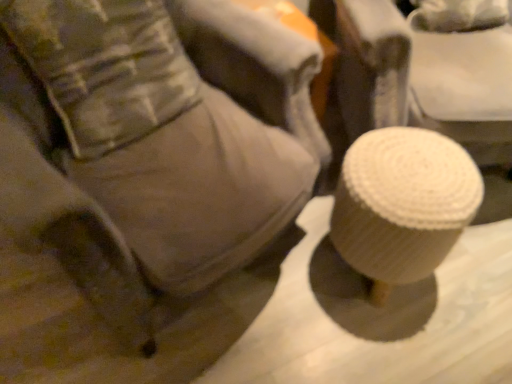
What do you see at coordinates (145, 183) in the screenshot? The image size is (512, 384). I see `white textured stool at lower right` at bounding box center [145, 183].

Image resolution: width=512 pixels, height=384 pixels. I want to click on white textured stool at lower right, so click(x=145, y=183).

What do you see at coordinates (104, 66) in the screenshot? The width and height of the screenshot is (512, 384). I see `camouflage fabric pillow at upper left` at bounding box center [104, 66].

Locate an element on the screen. Image resolution: width=512 pixels, height=384 pixels. camouflage fabric pillow at upper left is located at coordinates [104, 66].

In order to face camouflage fabric pillow at upper left, should I rotate leftwards or rightwards?

It's best to rotate left around 18.440 degrees.

Locate an element on the screen. This screenshot has width=512, height=384. white textured stool at lower right is located at coordinates (145, 183).

In the image, is camouflage fabric pillow at upper left on the left side or the right side of white textured stool at lower right?

In the image, camouflage fabric pillow at upper left appears on the left side of white textured stool at lower right.

Considering the positions of objects camouflage fabric pillow at upper left and white textured stool at lower right in the image provided, who is in front, camouflage fabric pillow at upper left or white textured stool at lower right?

Positioned in front is white textured stool at lower right.

Considering the positions of points (90, 4) and (142, 79), is point (90, 4) closer to camera compared to point (142, 79)?

Yes, point (90, 4) is in front of point (142, 79).

From the image's perspective, is camouflage fabric pillow at upper left located beneath white textured stool at lower right?

Actually, camouflage fabric pillow at upper left appears above white textured stool at lower right in the image.

From a real-world perspective, does camouflage fabric pillow at upper left stand above white textured stool at lower right?

Yes, from a real-world perspective, camouflage fabric pillow at upper left is over white textured stool at lower right

Considering the sizes of camouflage fabric pillow at upper left and white textured stool at lower right in the image, is camouflage fabric pillow at upper left wider or thinner than white textured stool at lower right?

camouflage fabric pillow at upper left is thinner than white textured stool at lower right.

Who is shorter, camouflage fabric pillow at upper left or white textured stool at lower right?

camouflage fabric pillow at upper left.

Between camouflage fabric pillow at upper left and white textured stool at lower right, which one has larger size?

Bigger between the two is white textured stool at lower right.

Is camouflage fabric pillow at upper left inside the boundaries of white textured stool at lower right, or outside?

camouflage fabric pillow at upper left lies within the bounds of white textured stool at lower right.

Is camouflage fabric pillow at upper left far away from white textured stool at lower right?

No, camouflage fabric pillow at upper left is not far from white textured stool at lower right.

Is camouflage fabric pillow at upper left aimed at white textured stool at lower right?

Yes, camouflage fabric pillow at upper left is oriented towards white textured stool at lower right.

In the image, there is a camouflage fabric pillow at upper left. What are the coordinates of `furniture below it (from a real-world perspective)` in the screenshot? It's located at (145, 183).

Which object is positioned more to the left, white textured stool at lower right or camouflage fabric pillow at upper left?

From the viewer's perspective, camouflage fabric pillow at upper left appears more on the left side.

Looking at this image, which object is closer to the camera, white textured stool at lower right or camouflage fabric pillow at upper left?

white textured stool at lower right is closer to the camera.

Does point (297, 172) come closer to viewer compared to point (55, 33)?

No, (297, 172) is further to viewer.

From the picture: From the image's perspective, is white textured stool at lower right positioned above or below camouflage fabric pillow at upper left?

white textured stool at lower right is situated lower than camouflage fabric pillow at upper left in the image.

From a real-world perspective, is white textured stool at lower right above or below camouflage fabric pillow at upper left?

In terms of real-world spatial position, white textured stool at lower right is below camouflage fabric pillow at upper left.

Is white textured stool at lower right wider or thinner than camouflage fabric pillow at upper left?

Clearly, white textured stool at lower right has more width compared to camouflage fabric pillow at upper left.

In terms of height, does white textured stool at lower right look taller or shorter compared to camouflage fabric pillow at upper left?

In the image, white textured stool at lower right appears to be taller than camouflage fabric pillow at upper left.

Can you confirm if white textured stool at lower right is bigger than camouflage fabric pillow at upper left?

Yes.

Which is correct: white textured stool at lower right is inside camouflage fabric pillow at upper left, or outside of it?

A: white textured stool at lower right lies outside camouflage fabric pillow at upper left.

Can you see white textured stool at lower right touching camouflage fabric pillow at upper left?

No, white textured stool at lower right is not next to camouflage fabric pillow at upper left.

Is white textured stool at lower right oriented away from camouflage fabric pillow at upper left?

Absolutely, white textured stool at lower right is directed away from camouflage fabric pillow at upper left.

How many degrees apart are the facing directions of white textured stool at lower right and camouflage fabric pillow at upper left?

The angle between the facing direction of white textured stool at lower right and the facing direction of camouflage fabric pillow at upper left is 1.63 degrees.

How far apart are white textured stool at lower right and camouflage fabric pillow at upper left?

white textured stool at lower right and camouflage fabric pillow at upper left are 5.99 inches apart.

Where is `furniture on the right of camouflage fabric pillow at upper left`? This screenshot has height=384, width=512. furniture on the right of camouflage fabric pillow at upper left is located at coordinates (145, 183).

Find the location of a particular element. furniture that appears on the right of camouflage fabric pillow at upper left is located at coordinates (145, 183).

This screenshot has width=512, height=384. Find the location of `furniture directly beneath the camouflage fabric pillow at upper left (from a real-world perspective)`. furniture directly beneath the camouflage fabric pillow at upper left (from a real-world perspective) is located at coordinates (145, 183).